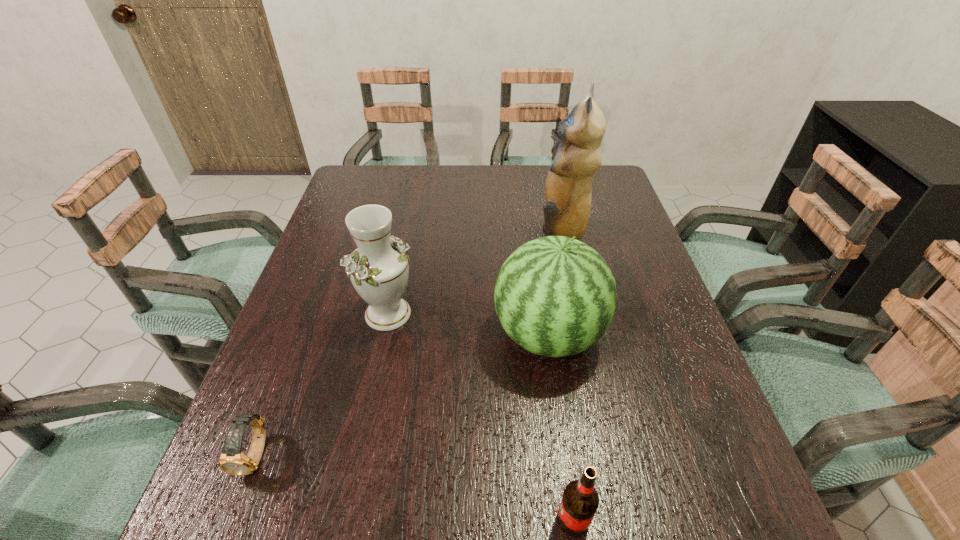
This screenshot has height=540, width=960. In order to click on vacant space located on the face of the cat in this screenshot , I will do `click(442, 234)`.

Locate an element on the screen. The width and height of the screenshot is (960, 540). vacant space situated on the front of the vase is located at coordinates (377, 363).

Identify the location of free space located 0.330m on the left of the watermelon. This screenshot has height=540, width=960. (348, 335).

Locate an element on the screen. vacant space situated on the right of the nearest object is located at coordinates (687, 519).

You are a GUI agent. You are given a task and a screenshot of the screen. Output one action in this format:
    pyautogui.click(x=<x>, y=<y>)
    Task: Click on the vacant space situated 0.070m on the face of the fourth farthest object
    This screenshot has height=540, width=960.
    Given the screenshot: What is the action you would take?
    pyautogui.click(x=230, y=525)

Where is `object present at the near edge`? The image size is (960, 540). object present at the near edge is located at coordinates (580, 501).

Find the location of a particular element. object at the left edge is located at coordinates (232, 460).

In order to click on object positioned at the right edge in this screenshot , I will do pos(568,190).

Image resolution: width=960 pixels, height=540 pixels. I want to click on free spot at the far edge of the desktop, so click(524, 181).

The height and width of the screenshot is (540, 960). In the image, there is a desktop. What are the coordinates of `vacant space at the left edge` in the screenshot? It's located at (320, 348).